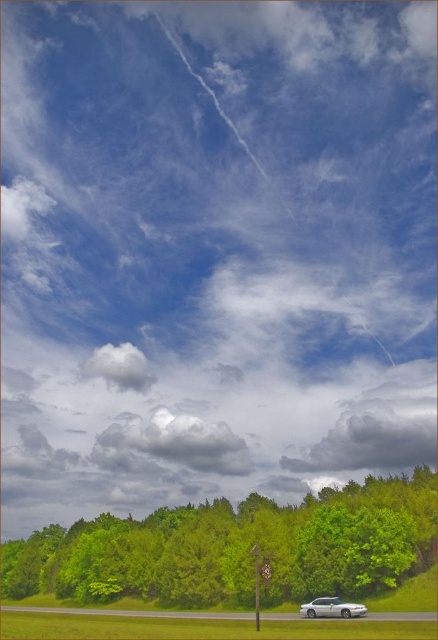
You are a bird flying in the sky. You want to land on the green leafy tree at lower center. Based on its 2D coordinates, where should you aim to land?

The green leafy tree at lower center is located at the 2D coordinates point (239, 548), so you should aim for that point to land on it.

You are an artist painting the scene and want to add a new element between the green leafy tree at lower center and the white fluffy cloud at center. Based on their positions, where should you place it?

The green leafy tree at lower center is positioned on the right side of the white fluffy cloud at center, so you should place the new element to the left of the green leafy tree at lower center or to the right of the white fluffy cloud at center.